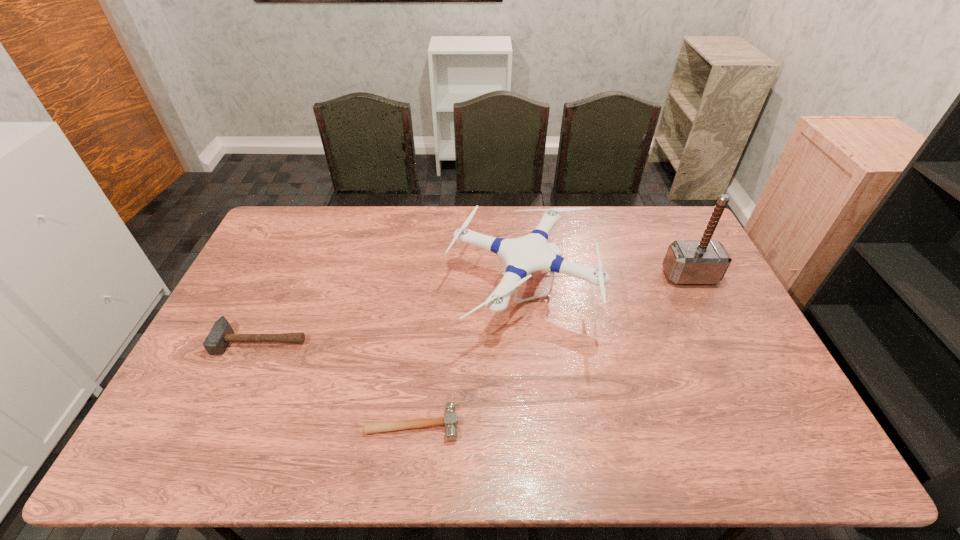
Identify the location of the rightmost hammer. (686, 262).

Locate an element on the screen. The width and height of the screenshot is (960, 540). the tallest object is located at coordinates click(x=686, y=262).

The width and height of the screenshot is (960, 540). Identify the location of the second tallest object. (525, 255).

Locate an element on the screen. The height and width of the screenshot is (540, 960). the leftmost object is located at coordinates (221, 334).

I want to click on the second tallest hammer, so click(221, 334).

The width and height of the screenshot is (960, 540). What are the coordinates of `the second hammer from right to left` in the screenshot? It's located at (450, 420).

Find the location of a particular element. The height and width of the screenshot is (540, 960). the nearest object is located at coordinates (450, 420).

Image resolution: width=960 pixels, height=540 pixels. Identify the location of vacant space located 0.290m on the left of the tallest object. (577, 276).

The width and height of the screenshot is (960, 540). I want to click on vacant region located on the left of the drone, so click(376, 291).

This screenshot has height=540, width=960. Find the location of `free space located 0.100m on the striking surface of the third tallest object`. free space located 0.100m on the striking surface of the third tallest object is located at coordinates (240, 387).